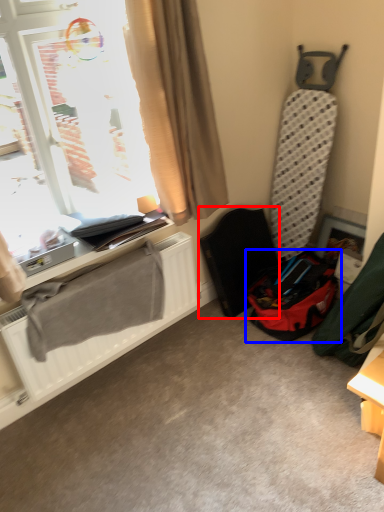
Question: Which point is further to the camera, folding chair (highlighted by a red box) or luggage and bags (highlighted by a blue box)?

Choices:
 (A) folding chair
 (B) luggage and bags

Answer: (A)